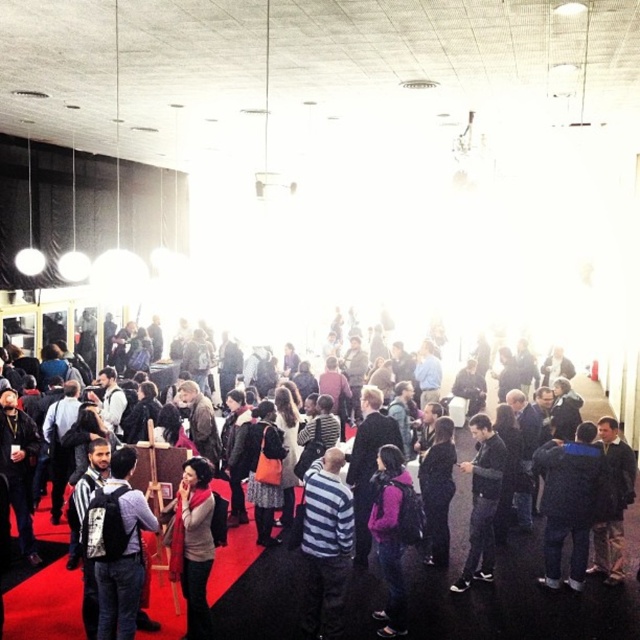
Question: Is dark gray backpack at lower left to the left of knitted sweater at center from the viewer's perspective?

Choices:
 (A) yes
 (B) no

Answer: (A)

Question: Which object appears farthest from the camera in this image?

Choices:
 (A) dark gray backpack at lower left
 (B) striped sweater at center
 (C) knitted sweater at center

Answer: (B)

Question: Considering the relative positions of striped sweater at center and dark blue jacket at lower right in the image provided, where is striped sweater at center located with respect to dark blue jacket at lower right?

Choices:
 (A) below
 (B) above

Answer: (B)

Question: Is striped sweater at center further to the viewer compared to knitted sweater at center?

Choices:
 (A) no
 (B) yes

Answer: (B)

Question: Which object is the closest to the striped cotton shirt at center?

Choices:
 (A) dark gray sweater at center
 (B) knitted sweater at center
 (C) dark gray backpack at lower left

Answer: (B)

Question: Which object is closer to the camera taking this photo?

Choices:
 (A) dark gray sweater at center
 (B) dark blue jacket at lower right
 (C) striped sweater at center
 (D) purple matte jacket at center

Answer: (C)